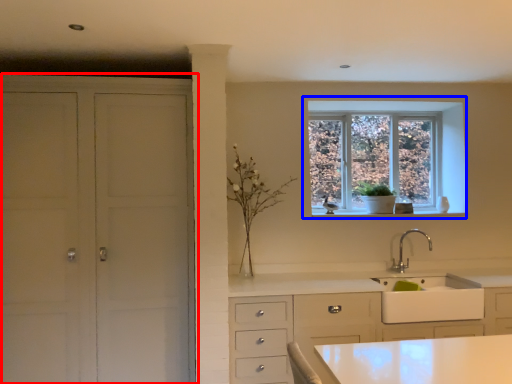
Question: Which of the following is the farthest to the observer, cupboard (highlighted by a red box) or window (highlighted by a blue box)?

Choices:
 (A) cupboard
 (B) window

Answer: (B)